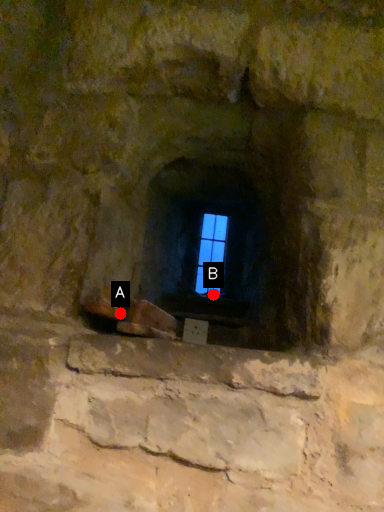
Question: Two points are circled on the image, labeled by A and B beside each circle. Which point appears farthest from the camera in this image?

Choices:
 (A) A is further
 (B) B is further

Answer: (B)